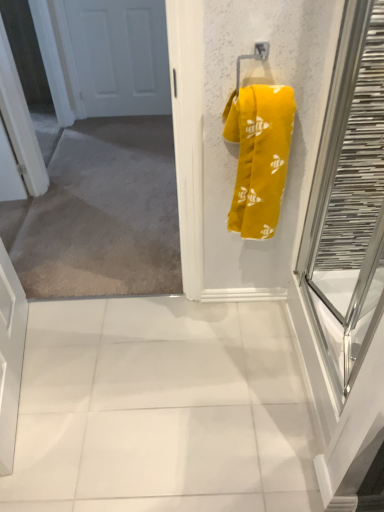
Identify the location of free space above white glossy tile at center (from a real-world perspective). This screenshot has height=512, width=384. (165, 390).